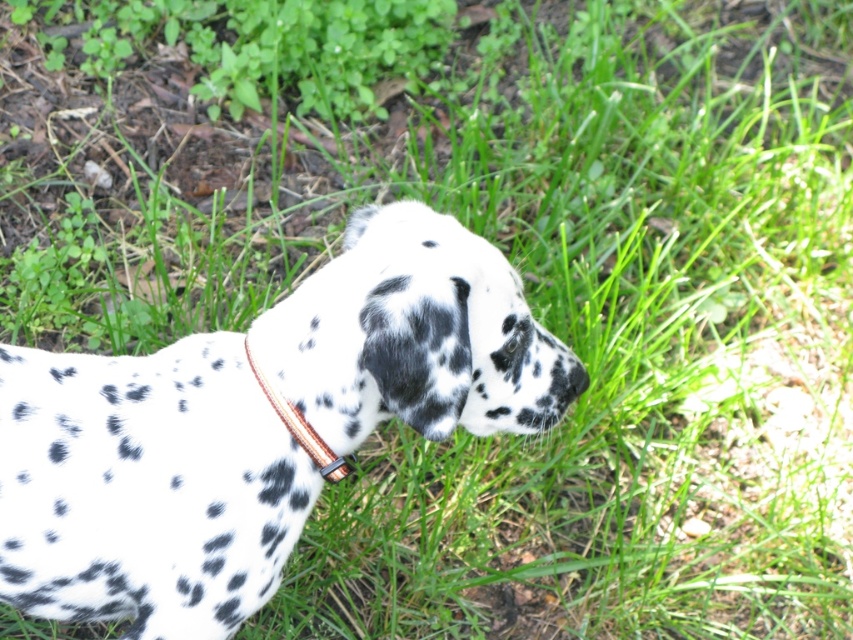
Is spotted fur at center to the right of brown leather collar at center from the viewer's perspective?

No, spotted fur at center is not to the right of brown leather collar at center.

Describe the element at coordinates (254, 426) in the screenshot. I see `spotted fur at center` at that location.

What are the coordinates of `spotted fur at center` in the screenshot? It's located at (254, 426).